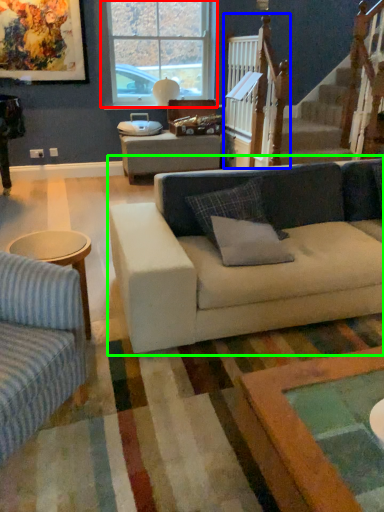
Question: Estimate the real-world distances between objects in this image. Which object is closer to window (highlighted by a red box), rail (highlighted by a blue box) or studio couch (highlighted by a green box)?

Choices:
 (A) rail
 (B) studio couch

Answer: (A)